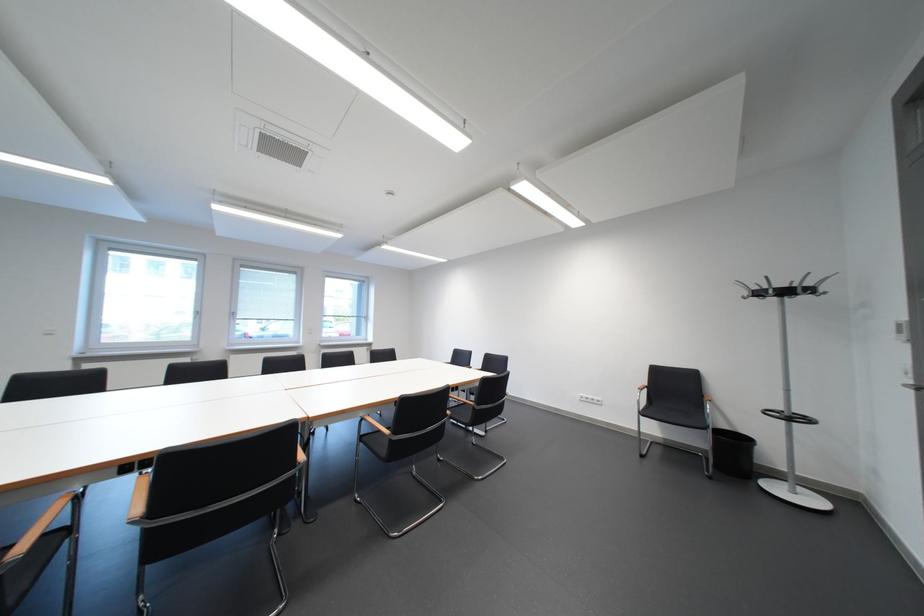
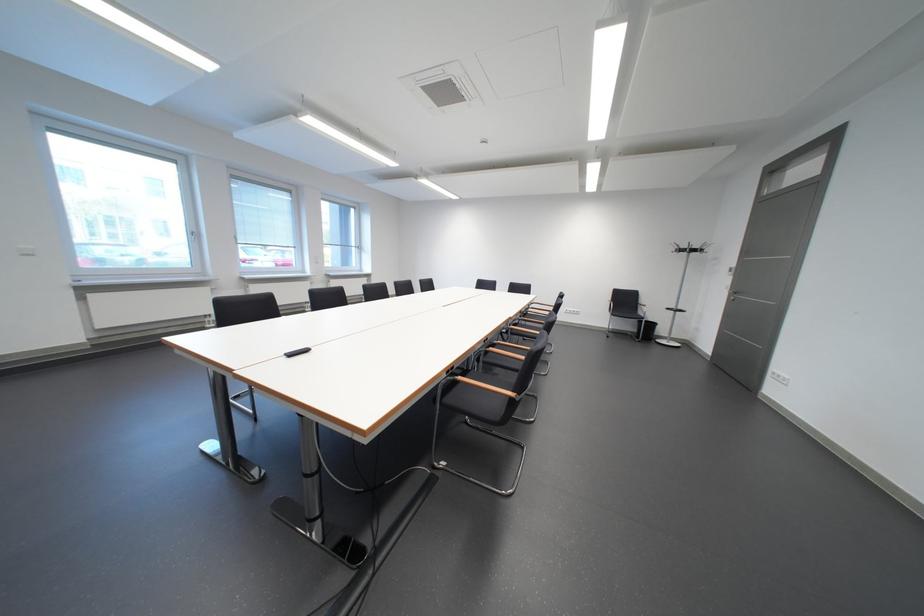
Question: The images are taken continuously from a first-person perspective. In which direction are you moving?

Choices:
 (A) Left
 (B) Right
 (C) Forward
 (D) Backward

Answer: (A)